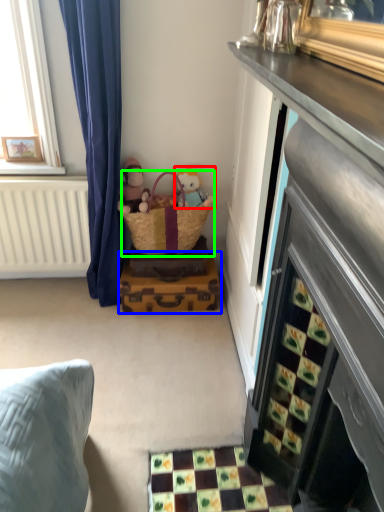
Question: Considering the real-world distances, which object is farthest from toy (highlighted by a red box)? luggage (highlighted by a blue box) or picnic basket (highlighted by a green box)?

Choices:
 (A) luggage
 (B) picnic basket

Answer: (A)